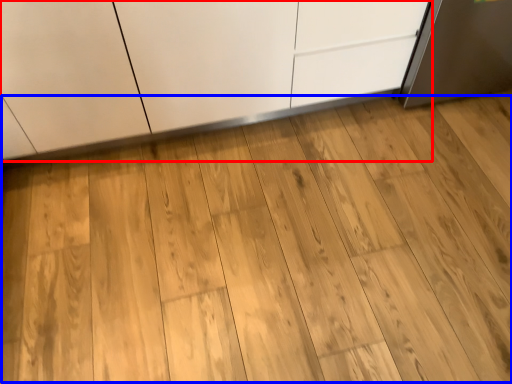
Question: Which object is further to the camera taking this photo, cabinetry (highlighted by a red box) or dresser (highlighted by a blue box)?

Choices:
 (A) cabinetry
 (B) dresser

Answer: (A)